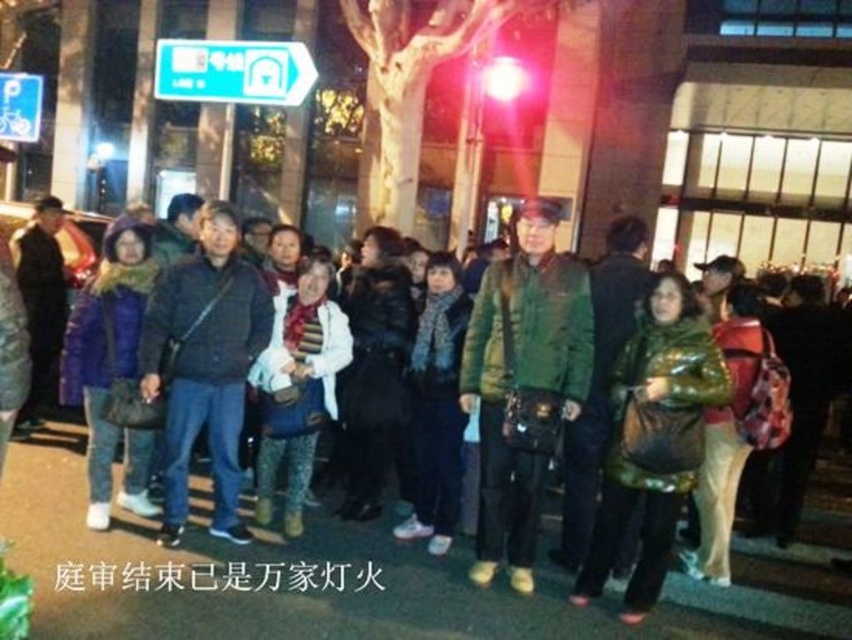
You are a photographer trying to capture a photo of the green matte jacket at center and the green plastic sign at upper left in the scene. Which object should you focus on first if you want to ensure both are in sharp focus, considering their sizes?

The green matte jacket at center is shorter than the green plastic sign at upper left, so you should focus on the green plastic sign at upper left first to ensure both are in sharp focus since it is larger and requires more attention.

Looking at this image, you are a delivery person who needs to place a package between the green quilted jacket at center and the dark blue jeans at center. The package is 1.5 meters long. Will it fit in the space between them?

The green quilted jacket at center is 2.08 meters from the dark blue jeans at center. Since the package is 1.5 meters long, it will fit in the space between them as the distance is greater than the package length.

You are taking a photo of the group of people in the scene. The camera is focused on the point at [580,358]. Will the point at [269,292] also be in focus?

Point [580,358] is closer to the camera than point [269,292]. Therefore, if the camera is focused on point [580,358], the point at [269,292] may not be in focus due to the depth of field limitations.